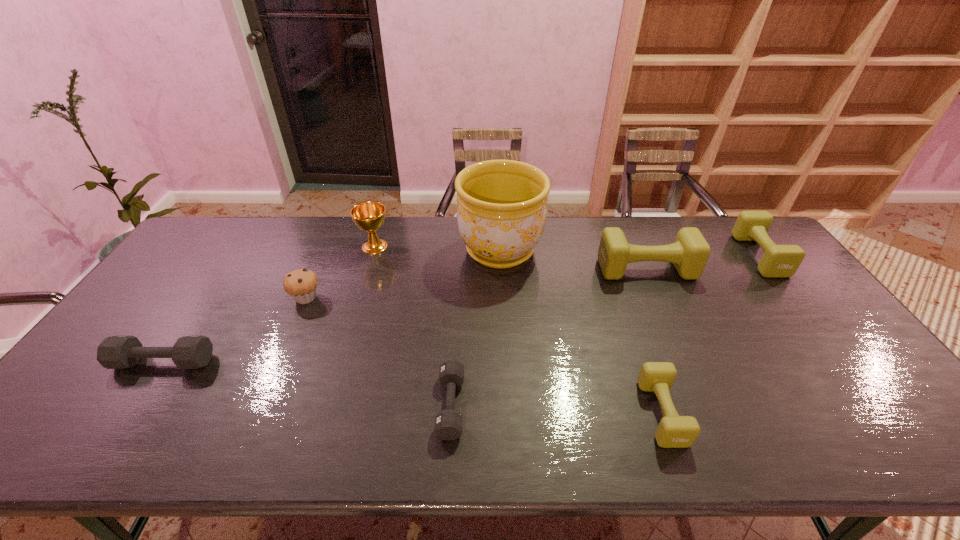
The height and width of the screenshot is (540, 960). I want to click on vacant region at the near right corner of the desktop, so click(x=903, y=436).

Locate an element on the screen. free spot between the nearest olive dumbbell and the left gray dumbbell is located at coordinates (413, 387).

The width and height of the screenshot is (960, 540). I want to click on vacant area that lies between the smallest olive dumbbell and the rightmost olive dumbbell, so click(x=710, y=334).

This screenshot has width=960, height=540. Find the location of `vacant space that is in between the flowerpot and the right gray dumbbell`. vacant space that is in between the flowerpot and the right gray dumbbell is located at coordinates (475, 328).

Where is `free area in between the chalice and the shortest object`? free area in between the chalice and the shortest object is located at coordinates (413, 326).

The image size is (960, 540). Identify the location of vacant space that is in between the leftmost dumbbell and the tallest dumbbell. (405, 315).

Find the location of a particular element. This screenshot has height=540, width=960. vacant region between the rightmost dumbbell and the third object from left to right is located at coordinates (567, 251).

The image size is (960, 540). I want to click on free space between the flowerpot and the muffin, so click(403, 274).

Where is `empty space that is in between the shortest object and the fourth nearest object`? The height and width of the screenshot is (540, 960). empty space that is in between the shortest object and the fourth nearest object is located at coordinates (378, 352).

Image resolution: width=960 pixels, height=540 pixels. Identify the location of object identified as the fourth closest to the tallest dumbbell. (448, 423).